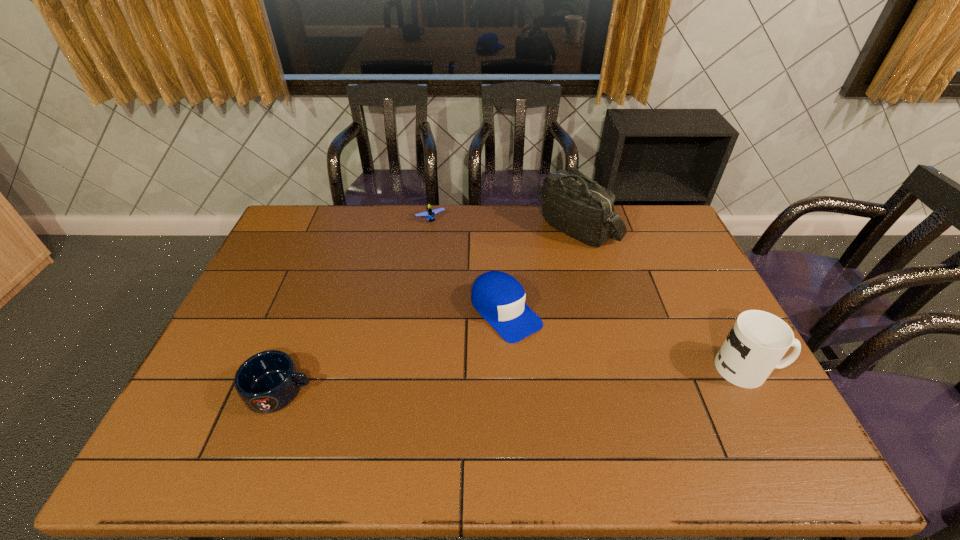
Locate an element on the screen. Image resolution: width=960 pixels, height=540 pixels. vacant space on the desktop that is between the second shortest object and the second tallest object and is positioned on the front-facing side of the baseball cap is located at coordinates (569, 377).

The height and width of the screenshot is (540, 960). What are the coordinates of `free spot on the desktop that is between the left mug and the rightmost object and is positioned at the front padded panel of the shoulder bag` in the screenshot? It's located at (463, 382).

Locate an element on the screen. free space on the desktop that is between the second shortest object and the taller mug and is positioned on the front-facing side of the shortest object is located at coordinates (521, 379).